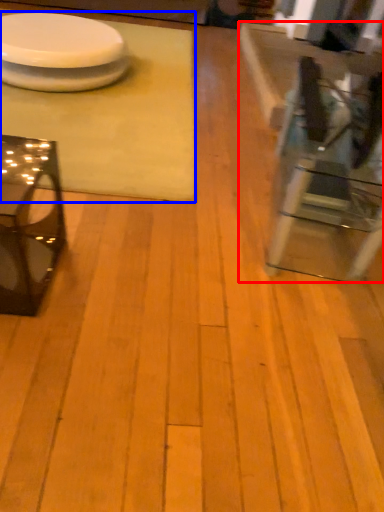
Question: Among these objects, which one is farthest to the camera, table (highlighted by a red box) or table (highlighted by a blue box)?

Choices:
 (A) table
 (B) table

Answer: (B)